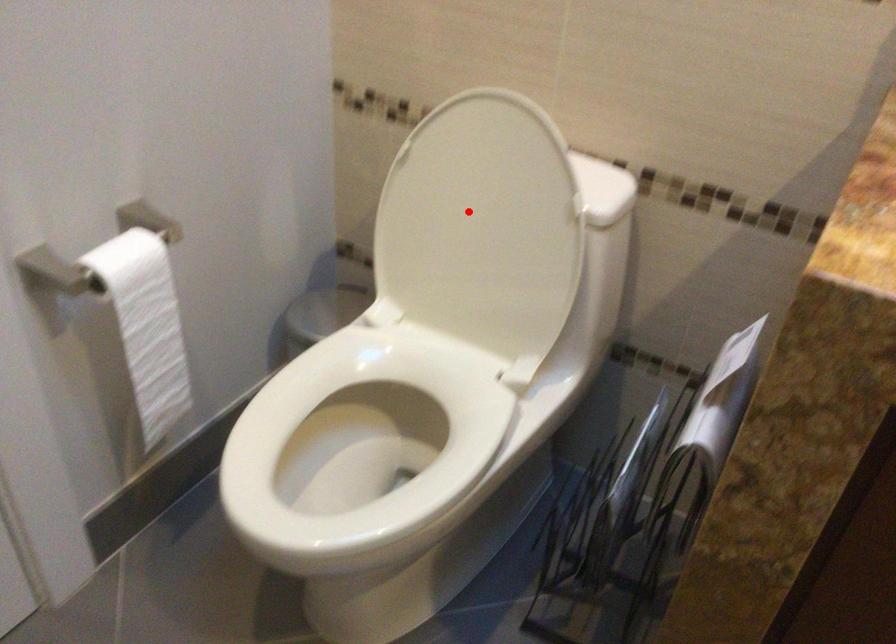
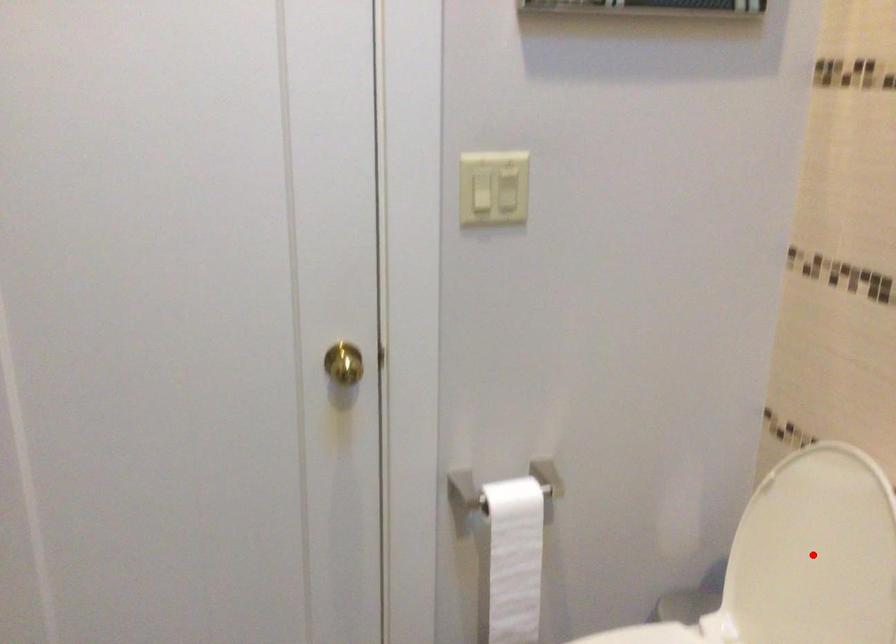
I am providing you with two images of the same scene from different viewpoints. A red point is marked on the first image and another point is marked on the second image. Is the marked point in image1 the same physical position as the marked point in image2?

Yes